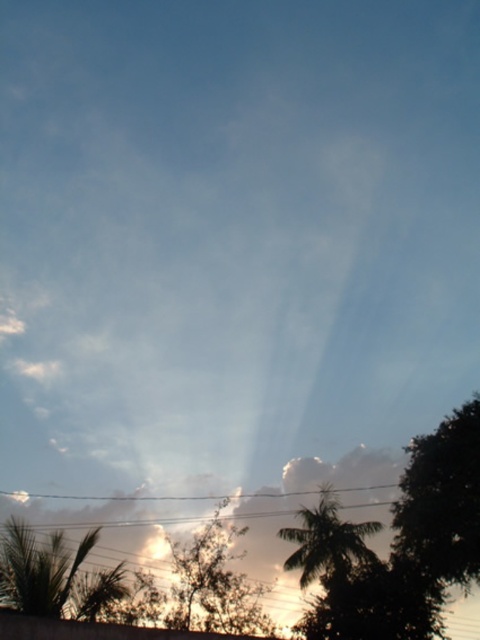
You are a bird flying over the serene sky scene. You see the green leafy tree at right and the green leafy tree at center. Which tree would you choose to land on if you prefer a thinner branch structure?

The green leafy tree at right is thinner than the green leafy tree at center, so you should choose the green leafy tree at right to land on if you prefer a thinner branch structure.

You are an artist sketching the scene. You need to decide which object to draw first based on their sizes. Which object should you start with, the green leafy tree at center or the silhouette leafy palm at lower right?

The green leafy tree at center is wider than the silhouette leafy palm at lower right, so you should start with the green leafy tree at center to ensure it has enough space on the paper.